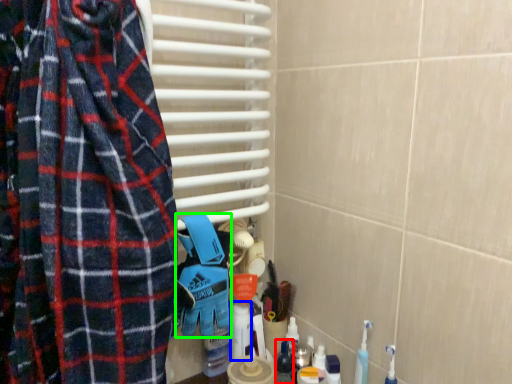
Question: Based on their relative distances, which object is farther from toiletry (highlighted by a red box)? Choose from cleaning product (highlighted by a blue box) and blanket (highlighted by a green box).

Choices:
 (A) cleaning product
 (B) blanket

Answer: (B)